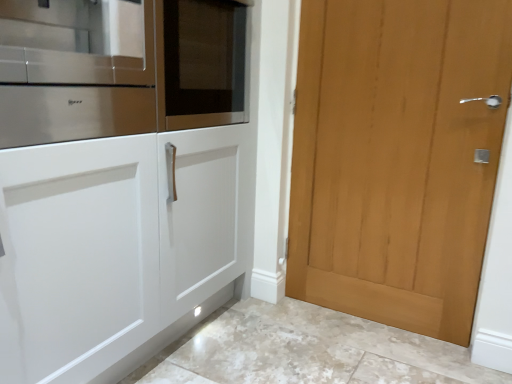
Find the location of a particular element. The width and height of the screenshot is (512, 384). vacant space situated above white marble floor at lower center (from a real-world perspective) is located at coordinates (324, 338).